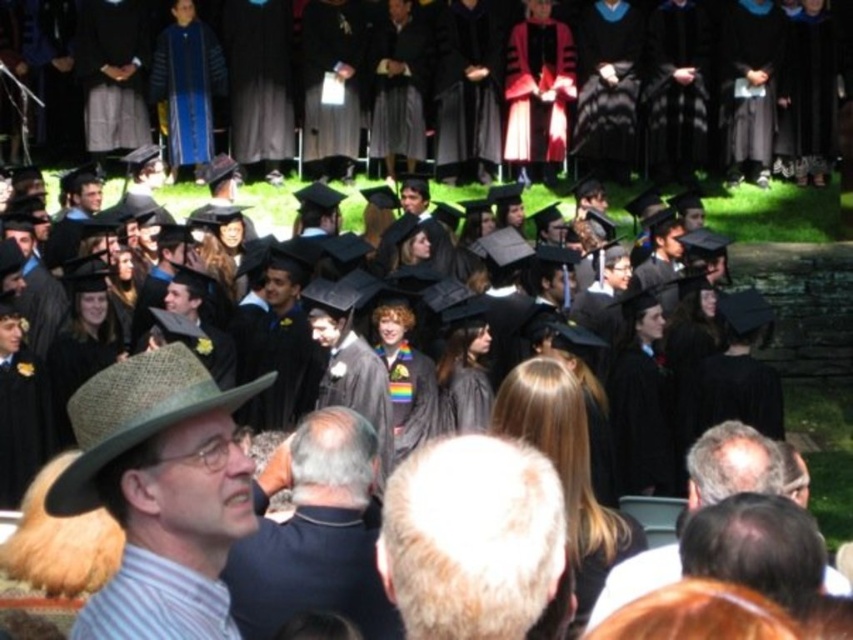
Looking at this image, you are a photographer at the graduation ceremony. You want to take a photo of the brown straw hat at left and the gray hair at center. Which object appears thinner in the photo?

The brown straw hat at left appears thinner than the gray hair at center in the photo.

You are a photographer at the graduation ceremony and want to capture a photo that includes both the brown straw hat at left and gray hair at center. Which object should be positioned to the left in your camera frame?

The brown straw hat at left should be positioned to the left of gray hair at center in the camera frame since it is already located to the left of gray hair at center in the scene.

You are a photographer at the graduation ceremony. You want to capture a photo that includes both the brown straw hat at left and the white hair at center. Which object should you place on the left side of your camera frame to ensure both are in the shot?

To ensure both the brown straw hat at left and the white hair at center are in the shot, you should place the brown straw hat at left on the left side of your camera frame since it is already positioned to the left of the white hair at center.